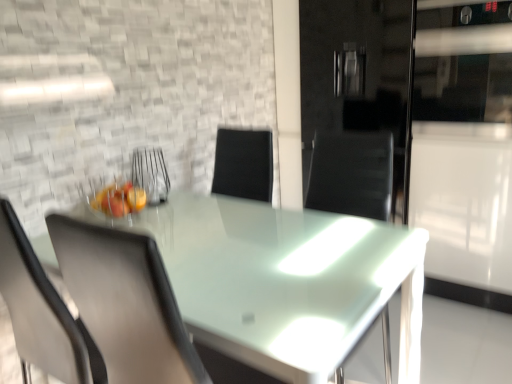
The width and height of the screenshot is (512, 384). What are the coordinates of `vacant region to the right of metallic wire basket at center` in the screenshot? It's located at (196, 208).